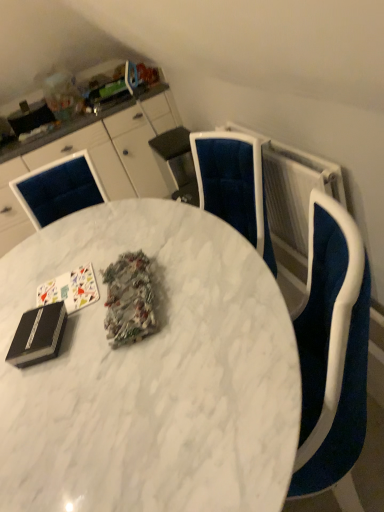
Identify the location of vacant area on top of white matte card game at upper left (from a real-world perspective). (59, 288).